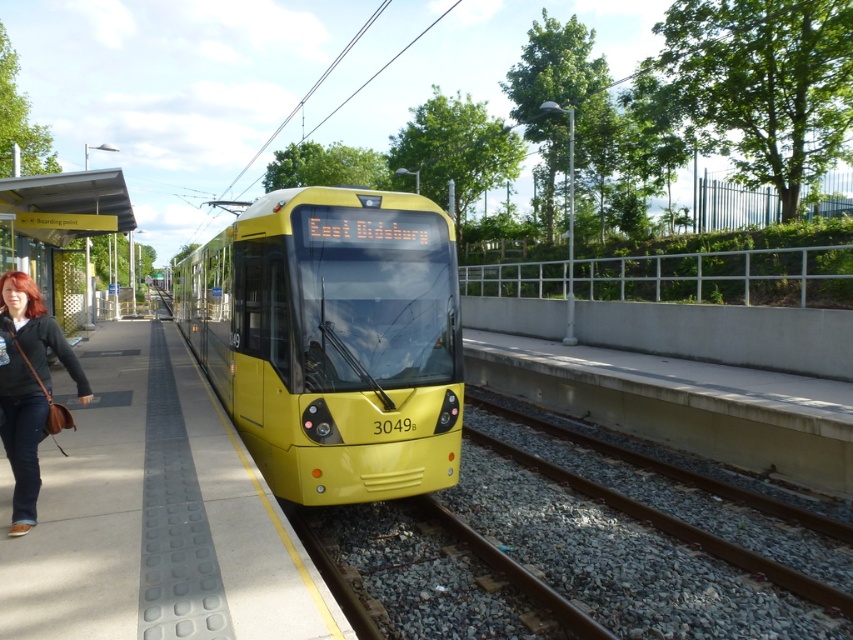
Question: Which point is closer to the camera?

Choices:
 (A) gravel train track at center
 (B) yellow rubber platform at center

Answer: (B)

Question: Does gravel train track at center appear under yellow plastic bus stop at left?

Choices:
 (A) no
 (B) yes

Answer: (B)

Question: Which point is farther from the camera taking this photo?

Choices:
 (A) (161, 596)
 (B) (466, 403)
 (C) (16, 387)
 (D) (100, 205)

Answer: (D)

Question: Is yellow rubber platform at center below matte brown leather bag at lower left?

Choices:
 (A) no
 (B) yes

Answer: (B)

Question: Among these points, which one is farthest from the camera?

Choices:
 (A) (3, 252)
 (B) (762, 579)
 (C) (363, 570)

Answer: (A)

Question: Can you confirm if yellow metal train track at center is positioned to the right of gravel train track at center?

Choices:
 (A) yes
 (B) no

Answer: (A)